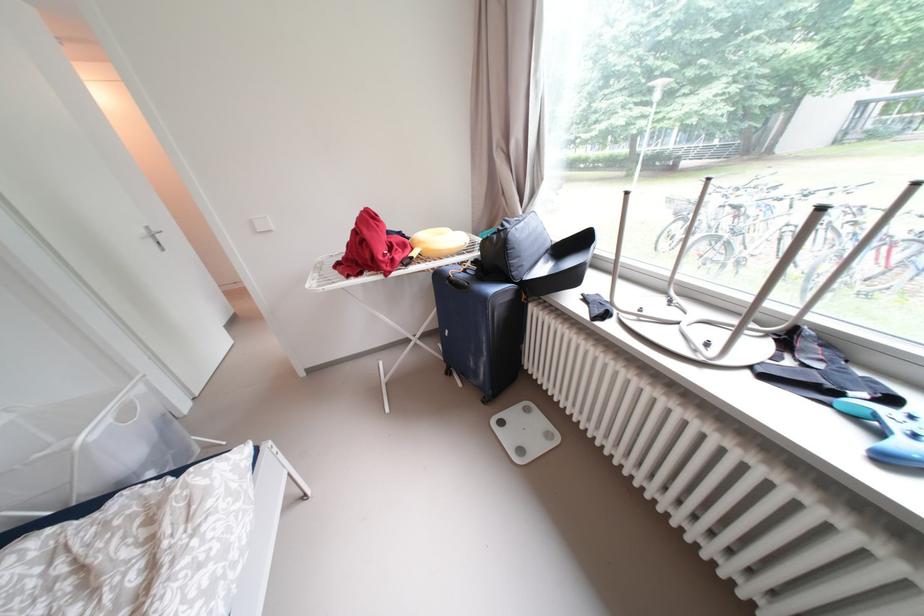
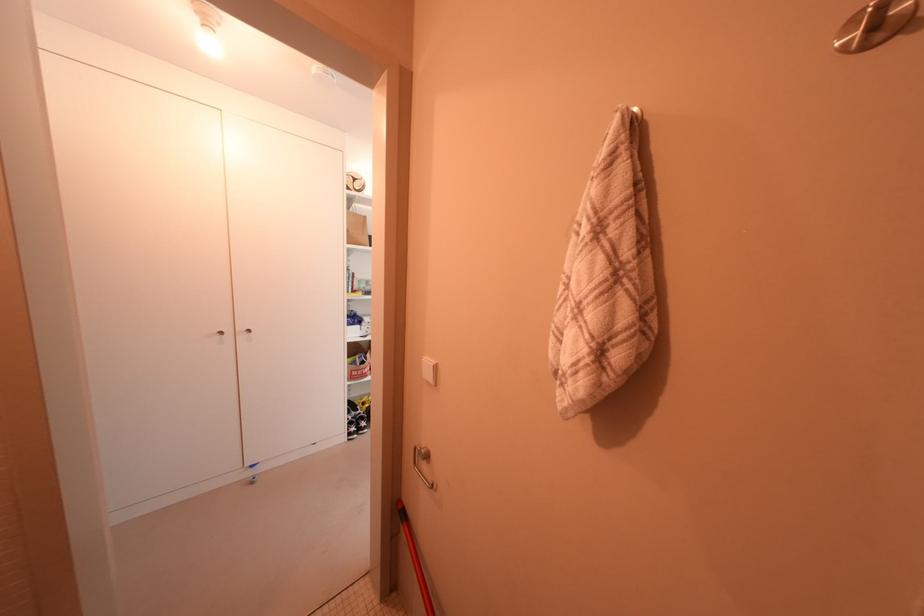
What movement of the cameraman would produce the second image?

The movement direction of the cameraman is left, forward.